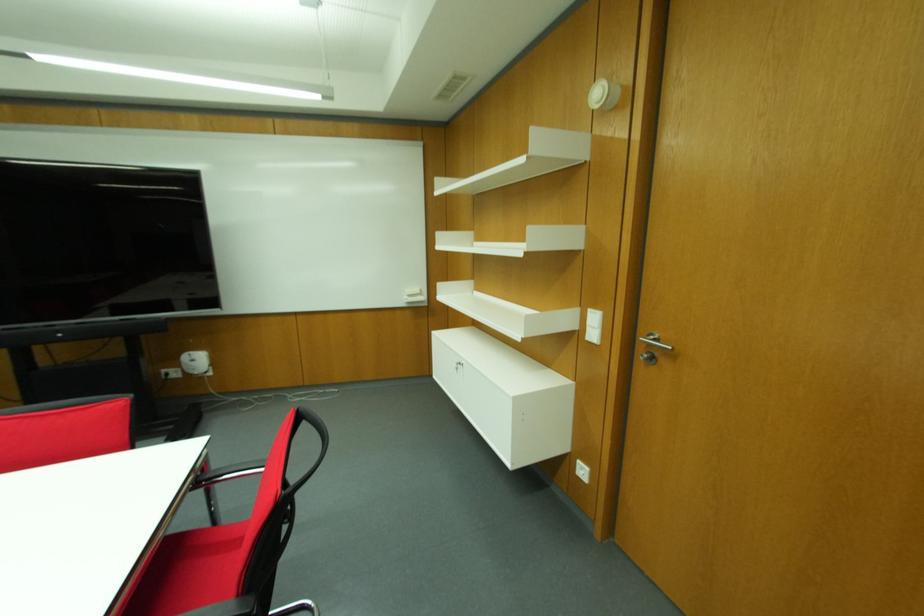
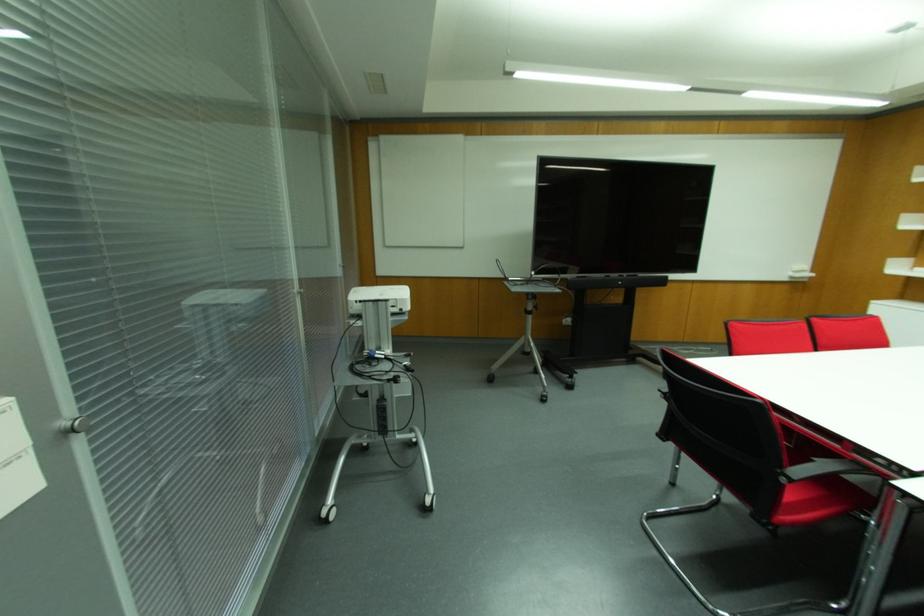
In the second image, find the point that corresponds to (x=422, y=299) in the first image.

(811, 274)